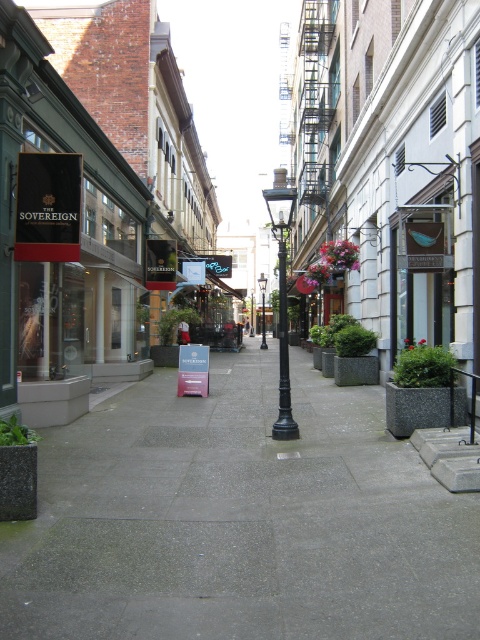
You are a city planner assessing the street layout. You need to install a new traffic light that must be at least 3 meters tall. Given the black polished metal streetlight at center and metallic silver sign at center, which object can accommodate the traffic light pole in terms of height?

The black polished metal streetlight at center is taller than metallic silver sign at center, so the traffic light pole can be installed on the black polished metal streetlight at center as it meets the height requirement.

You are a delivery person trying to park your bike on the gray concrete pavement at center. However, there is a black metal lamp post at center in the way. Can you fit your bike there if the bike requires 2 square meters of space?

The gray concrete pavement at center occupies less space than the black metal lamp post at center. Since the pavement has less area than the lamp post, it likely doesn not have enough space for the bike requiring 2 square meters. Therefore, you cannot park your bike there.